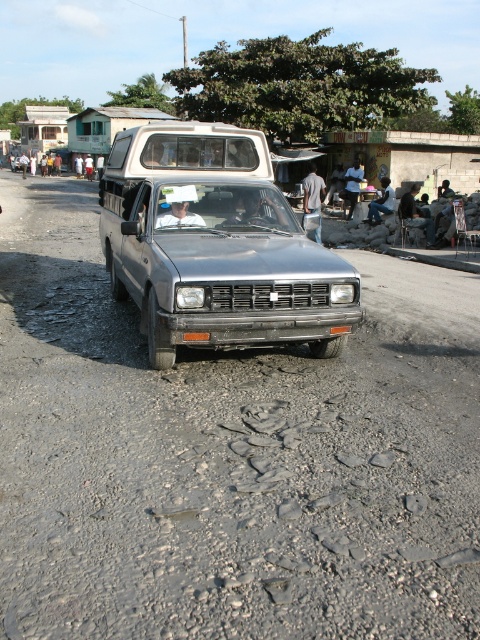
Question: Based on their relative distances, which object is farther from the silver metallic pickup truck at center?

Choices:
 (A) dark blue jeans at center
 (B) gray fabric shirt at center

Answer: (A)

Question: Considering the relative positions of white matte shirt at center and dark blue jeans at center in the image provided, where is white matte shirt at center located with respect to dark blue jeans at center?

Choices:
 (A) above
 (B) below

Answer: (B)

Question: Is gray gravel road at center in front of silver metallic pickup truck at center?

Choices:
 (A) yes
 (B) no

Answer: (A)

Question: Which point is farther to the camera?

Choices:
 (A) silver metallic pickup truck at center
 (B) gray gravel road at center
 (C) gray fabric shirt at center
 (D) dark blue jeans at center

Answer: (D)

Question: Is white matte shirt at center wider than dark gray fabric jacket at center?

Choices:
 (A) no
 (B) yes

Answer: (A)

Question: Which object is the closest to the silver metallic pickup truck at center?

Choices:
 (A) dark gray fabric jacket at center
 (B) gray gravel road at center

Answer: (B)